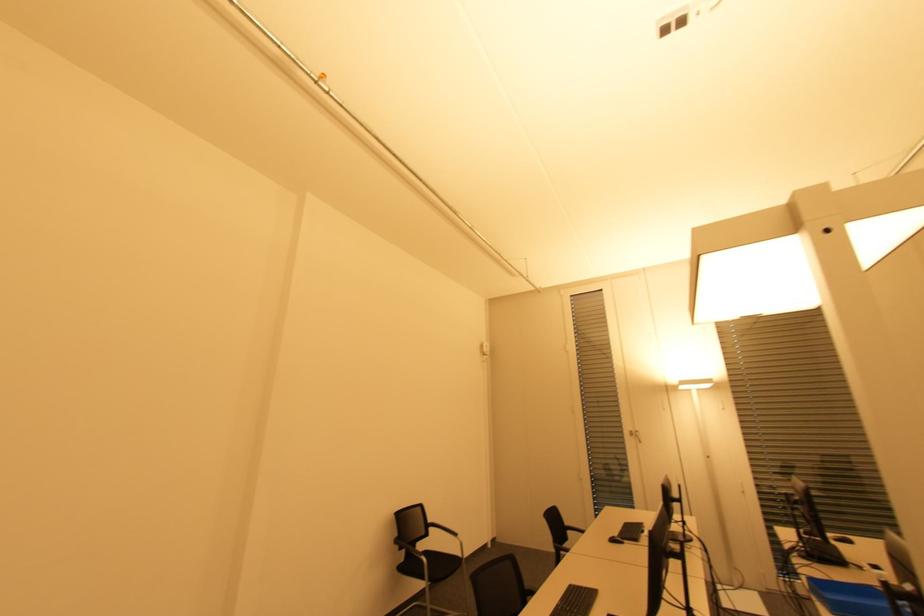
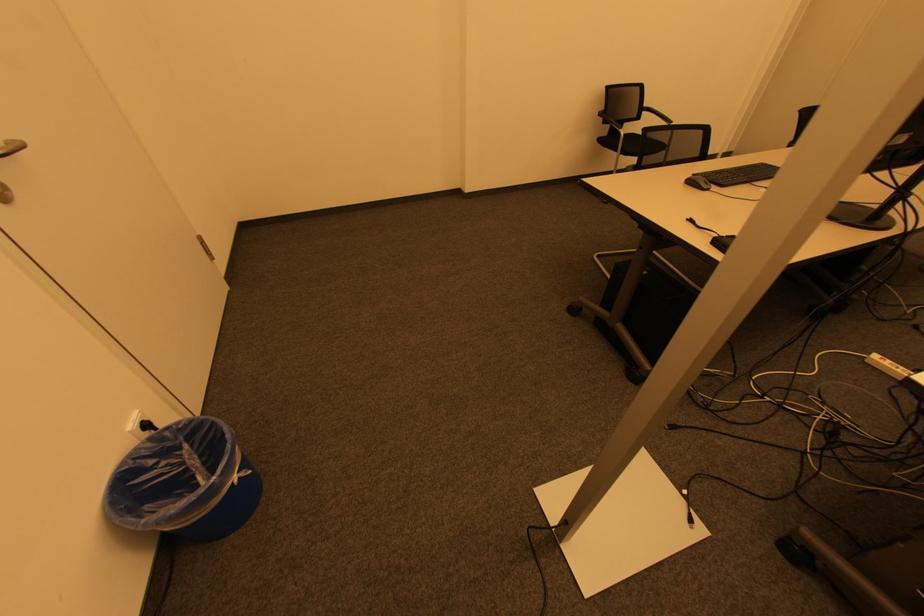
The first image is from the beginning of the video and the second image is from the end. How did the camera likely rotate when shooting the video?

The rotation direction of the camera is left-down.